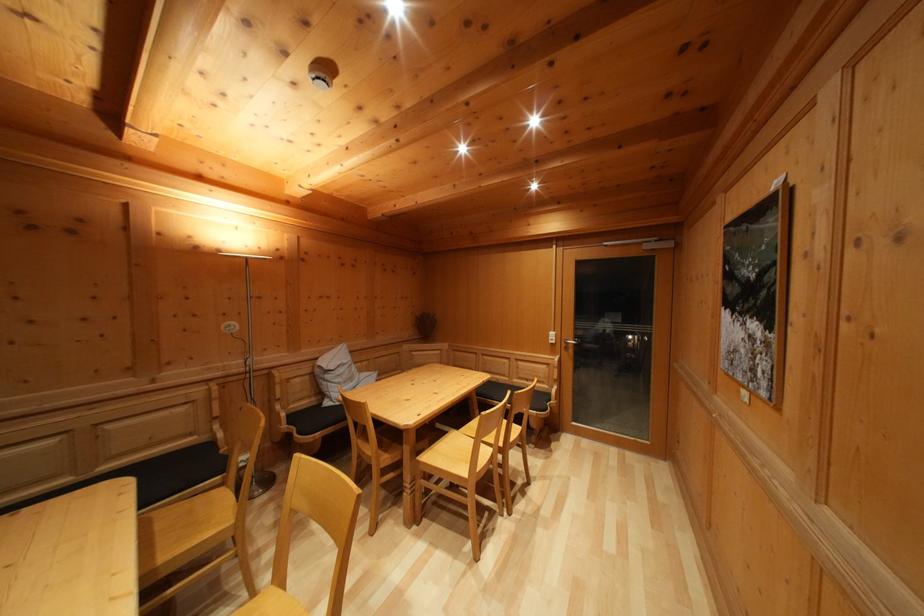
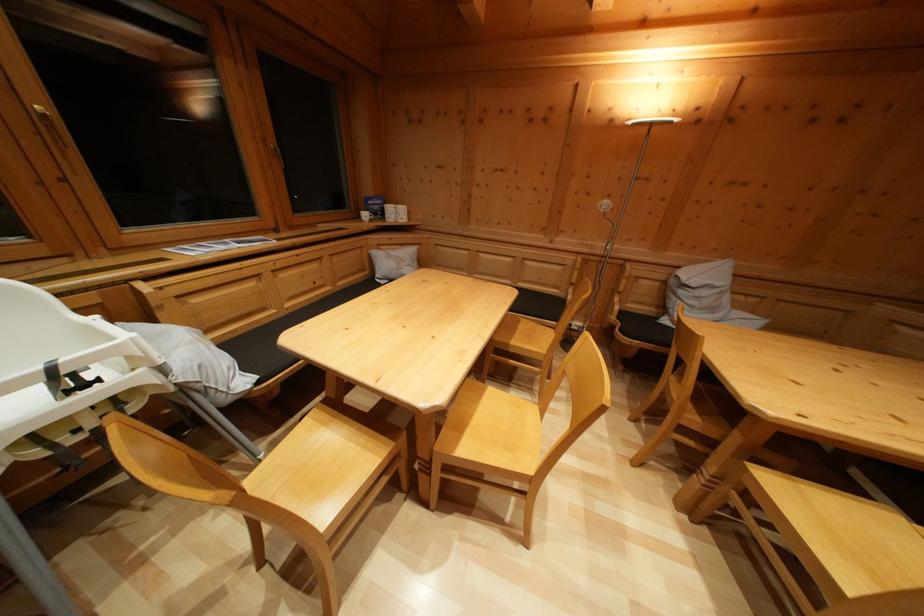
In the second image, find the point that corresponds to point (237, 330) in the first image.

(613, 208)